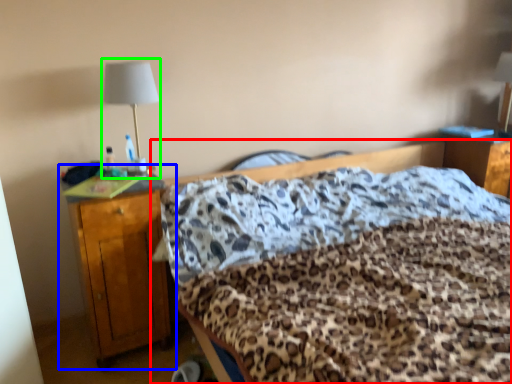
Question: Estimate the real-world distances between objects in this image. Which object is closer to bed (highlighted by a red box), nightstand (highlighted by a blue box) or bedside lamp (highlighted by a green box)?

Choices:
 (A) nightstand
 (B) bedside lamp

Answer: (A)